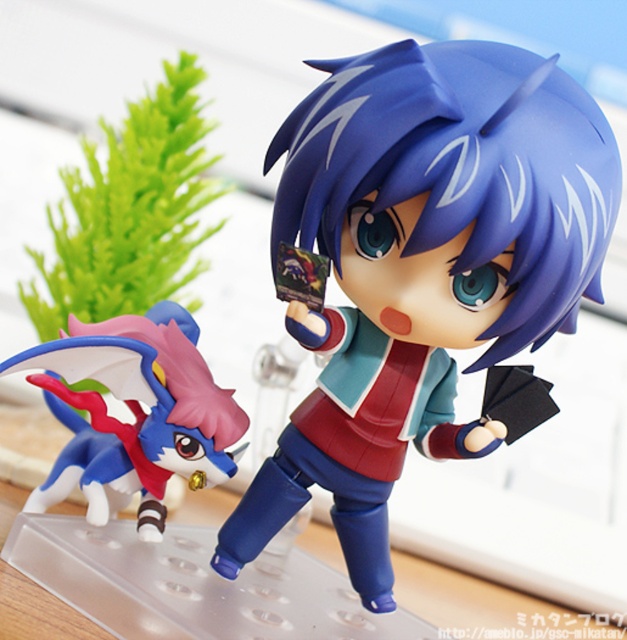
Image resolution: width=627 pixels, height=640 pixels. In order to click on matte plastic doll at center in this screenshot , I will do `click(423, 266)`.

Which is in front, point (606, 225) or point (103, 502)?

Point (606, 225) is in front.

Identify the location of matte plastic doll at center. (423, 266).